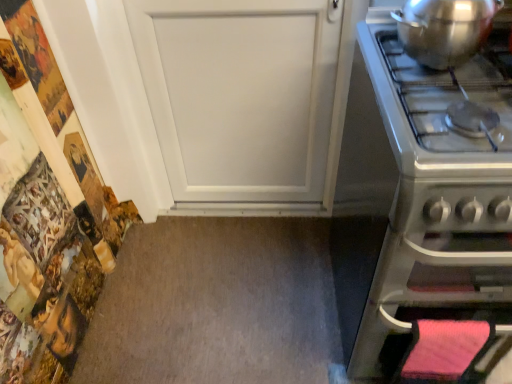
Question: Considering their positions, is shiny metallic pot at upper right located in front of or behind satin silver oven at right?

Choices:
 (A) front
 (B) behind

Answer: (B)

Question: Considering the positions of shiny metallic pot at upper right and satin silver oven at right in the image, is shiny metallic pot at upper right wider or thinner than satin silver oven at right?

Choices:
 (A) thin
 (B) wide

Answer: (A)

Question: Based on their sizes in the image, would you say shiny metallic pot at upper right is bigger or smaller than satin silver oven at right?

Choices:
 (A) big
 (B) small

Answer: (B)

Question: Considering the positions of satin silver oven at right and shiny metallic pot at upper right in the image, is satin silver oven at right wider or thinner than shiny metallic pot at upper right?

Choices:
 (A) thin
 (B) wide

Answer: (B)

Question: Would you say satin silver oven at right is inside or outside shiny metallic pot at upper right?

Choices:
 (A) outside
 (B) inside

Answer: (A)

Question: Relative to shiny metallic pot at upper right, is satin silver oven at right in front or behind?

Choices:
 (A) behind
 (B) front

Answer: (B)

Question: From a real-world perspective, is satin silver oven at right physically located above or below shiny metallic pot at upper right?

Choices:
 (A) above
 (B) below

Answer: (B)